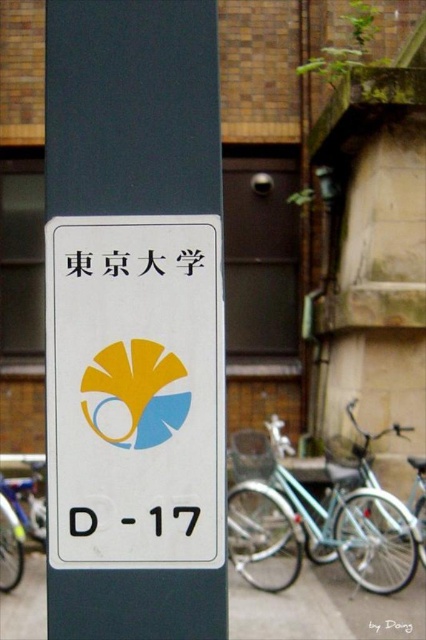
You are standing in front of the sign on the dark blue pole. There are two points marked on the sign. The first point is at coordinates point (51, 8) and the second is at point (305, 548). Which point is closer to you?

Point (51, 8) is closer to the viewer than point (305, 548).